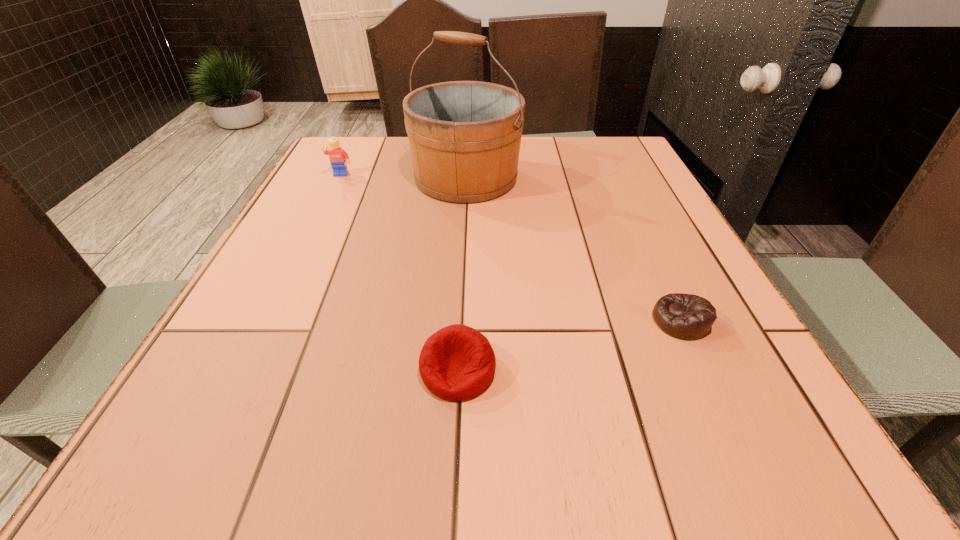
This screenshot has width=960, height=540. In order to click on vacant space at the far right corner of the desktop in this screenshot , I will do `click(589, 162)`.

At what (x,y) coordinates should I click in order to perform the action: click on blank area at the near right corner. Please return your answer as a coordinate pair (x, y). Looking at the image, I should click on (734, 465).

You are a GUI agent. You are given a task and a screenshot of the screen. Output one action in this format:
    pyautogui.click(x=<x>, y=<y>)
    Task: Click on the empty space between the taller beanbag and the leftmost object
    This screenshot has width=960, height=540.
    Given the screenshot: What is the action you would take?
    pyautogui.click(x=399, y=273)

Identify the location of vacant area that lies between the bucket and the Lego. This screenshot has width=960, height=540. (403, 177).

Find the location of `free space between the third tallest object and the rightmost object`. free space between the third tallest object and the rightmost object is located at coordinates (569, 345).

Where is `vacant region between the third tallest object and the shortest object`? This screenshot has width=960, height=540. vacant region between the third tallest object and the shortest object is located at coordinates (569, 345).

Locate an element on the screen. unoccupied area between the bucket and the taller beanbag is located at coordinates (462, 274).

Find the location of a particular element. This screenshot has height=540, width=960. free space that is in between the tallest object and the taller beanbag is located at coordinates (462, 274).

Where is `vacant area that lies between the Lego and the second shortest object`? vacant area that lies between the Lego and the second shortest object is located at coordinates (399, 273).

You are a GUI agent. You are given a task and a screenshot of the screen. Output one action in this format:
    pyautogui.click(x=<x>, y=<y>)
    Task: Click on the free space between the shorter beanbag and the tallest object
    This screenshot has width=960, height=540.
    Given the screenshot: What is the action you would take?
    pyautogui.click(x=573, y=249)